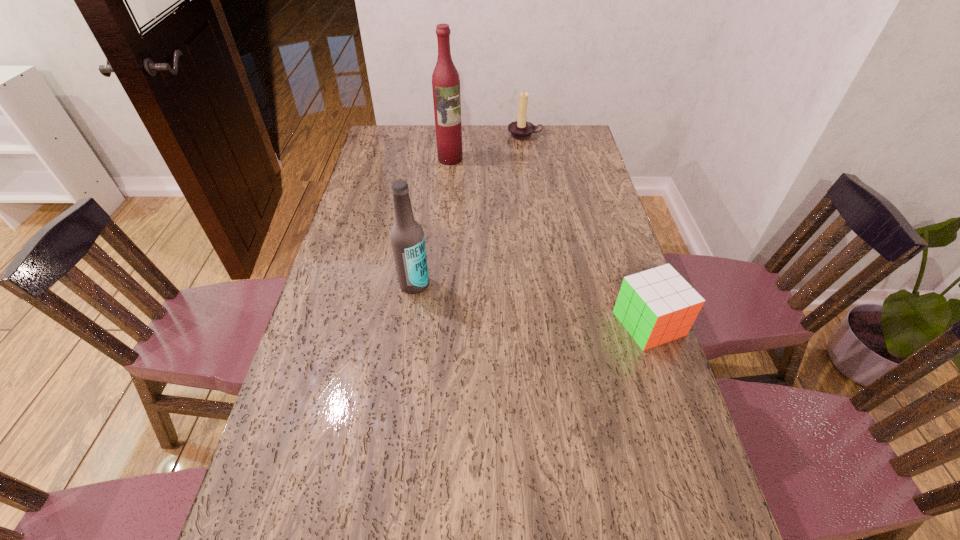
At what (x,y) coordinates should I click in order to perform the action: click on unoccupied area between the nearest object and the farthest object. Please return your answer as a coordinate pair (x, y). This screenshot has width=960, height=540. Looking at the image, I should click on (587, 230).

Find the location of `free area in between the rightmost object and the third shortest object`. free area in between the rightmost object and the third shortest object is located at coordinates (532, 304).

Locate an element on the screen. The height and width of the screenshot is (540, 960). vacant area that lies between the third shortest object and the tallest object is located at coordinates (432, 221).

Locate an element on the screen. empty space that is in between the beer bottle and the rightmost object is located at coordinates (532, 304).

Identify which object is the nearest to the shortest object. Please provide its 2D coordinates. Your answer should be formatted as a tuple, i.e. [(x, y)], where the tuple contains the x and y coordinates of a point satisfying the conditions above.

[(407, 237)]

Identify which object is the nearest to the liquor. Please provide its 2D coordinates. Your answer should be formatted as a tuple, i.e. [(x, y)], where the tuple contains the x and y coordinates of a point satisfying the conditions above.

[(521, 129)]

Find the location of `blank space that satisfies the following two spatial constraints: 1. on the back side of the second shortest object; 2. on the left side of the third nearest object`. blank space that satisfies the following two spatial constraints: 1. on the back side of the second shortest object; 2. on the left side of the third nearest object is located at coordinates (452, 135).

This screenshot has width=960, height=540. Identify the location of vacant region that satisfies the following two spatial constraints: 1. on the back side of the liquor; 2. on the right side of the second object from right to left. (452, 135).